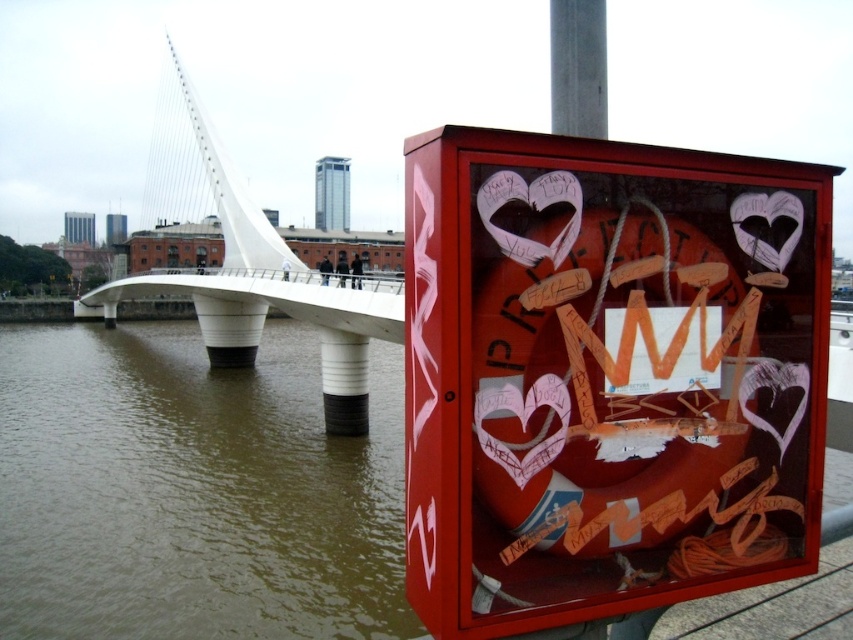
Question: Estimate the real-world distances between objects in this image. Which object is farther from the shiny red box at center?

Choices:
 (A) smooth concrete pole at upper center
 (B) white matte bridge at upper center

Answer: (B)

Question: Which point is closer to the camera taking this photo?

Choices:
 (A) (593, 115)
 (B) (450, 460)

Answer: (B)

Question: Among these points, which one is farthest from the camera?

Choices:
 (A) (494, 552)
 (B) (601, 88)

Answer: (B)

Question: Is the position of shiny red box at center less distant than that of brown murky water at lower left?

Choices:
 (A) no
 (B) yes

Answer: (B)

Question: Is shiny red box at center below brown murky water at lower left?

Choices:
 (A) yes
 (B) no

Answer: (B)

Question: Is shiny red box at center to the right of smooth concrete pole at upper center from the viewer's perspective?

Choices:
 (A) no
 (B) yes

Answer: (A)